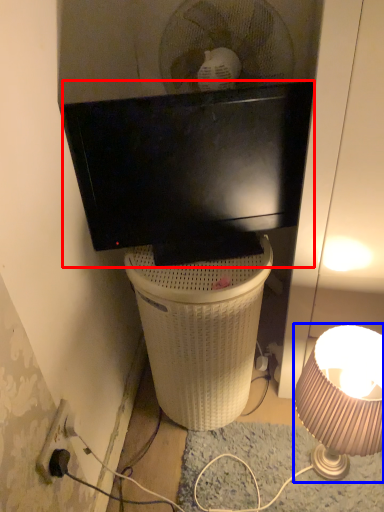
Question: Which object is further to the camera taking this photo, television (highlighted by a red box) or lamp (highlighted by a blue box)?

Choices:
 (A) television
 (B) lamp

Answer: (A)